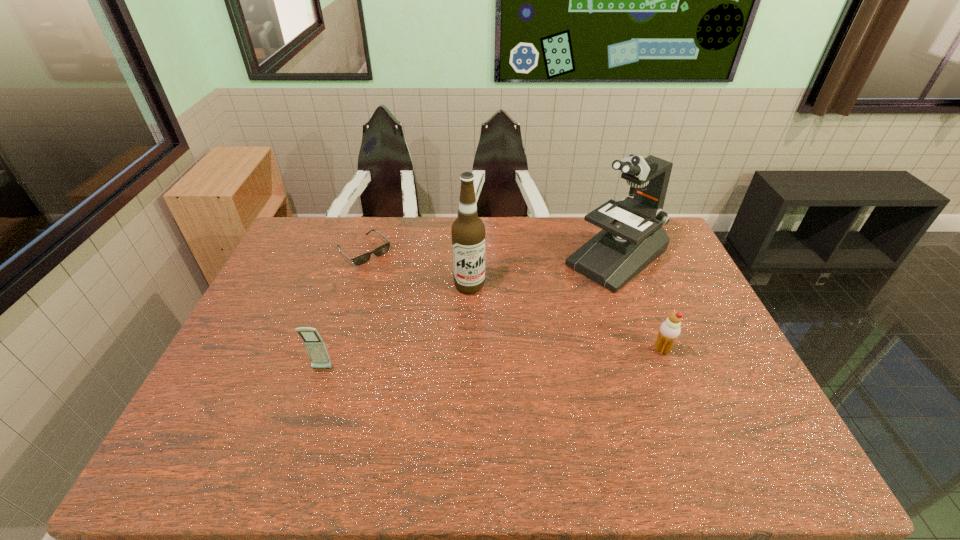
Find the location of a particular element. This screenshot has width=960, height=540. vacant region located through the eyepieces of the microscope is located at coordinates coord(499,347).

Locate an element on the screen. This screenshot has width=960, height=540. vacant space located 0.150m on the front-facing side of the sunglasses is located at coordinates (404, 286).

You are a GUI agent. You are given a task and a screenshot of the screen. Output one action in this format:
    pyautogui.click(x=<x>, y=<y>)
    Task: Click on the vacant space situated on the front-facing side of the sunglasses
    The width and height of the screenshot is (960, 540).
    Given the screenshot: What is the action you would take?
    pyautogui.click(x=402, y=285)

You are a GUI agent. You are given a task and a screenshot of the screen. Output one action in this format:
    pyautogui.click(x=<x>, y=<y>)
    Task: Click on the blank space located on the front-facing side of the sunglasses
    The image size is (960, 540).
    Given the screenshot: What is the action you would take?
    pyautogui.click(x=420, y=301)

You are a GUI agent. You are given a task and a screenshot of the screen. Output one action in this format:
    pyautogui.click(x=<x>, y=<y>)
    Task: Click on the blank space located 0.050m on the label of the third object from left to right
    The width and height of the screenshot is (960, 540).
    Given the screenshot: What is the action you would take?
    pyautogui.click(x=477, y=307)

Where is `blank area located on the label of the third object from left to right`? blank area located on the label of the third object from left to right is located at coordinates (506, 382).

You are a GUI agent. You are given a task and a screenshot of the screen. Output one action in this format:
    pyautogui.click(x=<x>, y=<y>)
    Task: Click on the free space located on the label of the third object from left to right
    The image size is (960, 540).
    Given the screenshot: What is the action you would take?
    pyautogui.click(x=485, y=326)

At what (x,y) coordinates should I click in order to perform the action: click on microscope that is at the far edge. Please return your answer as a coordinate pair (x, y). Looking at the image, I should click on (632, 237).

I want to click on sunglasses present at the far edge, so click(382, 249).

The width and height of the screenshot is (960, 540). I want to click on icecream positioned at the right edge, so click(x=669, y=330).